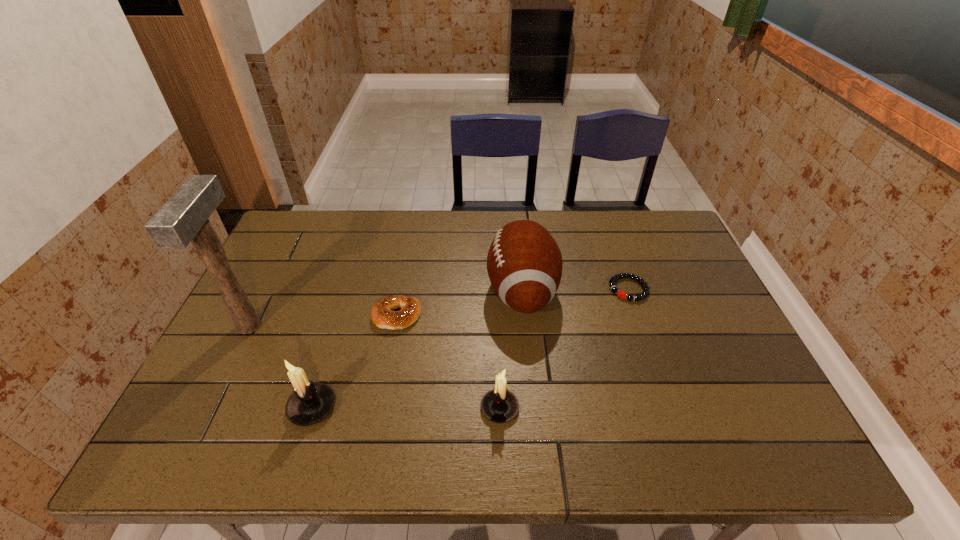
The height and width of the screenshot is (540, 960). What are the coordinates of `the third object from left to right` in the screenshot? It's located at [382, 314].

Identify the location of free space located 0.110m on the left of the left candle holder. The width and height of the screenshot is (960, 540). 240,407.

At what (x,y) coordinates should I click in order to perform the action: click on free space located 0.390m on the left of the right candle holder. Please return your answer as a coordinate pair (x, y). The width and height of the screenshot is (960, 540). Looking at the image, I should click on (310, 408).

Locate an element on the screen. Image resolution: width=960 pixels, height=540 pixels. free space located on the left of the shortest object is located at coordinates (588, 289).

Identify the location of vacant space situated 0.370m on the back of the mallet. (300, 224).

Where is `vacant area situated 0.270m on the laces of the second tallest object`? vacant area situated 0.270m on the laces of the second tallest object is located at coordinates (394, 291).

This screenshot has width=960, height=540. What are the coordinates of `blank space located 0.320m on the laces of the second tallest object` in the screenshot? It's located at (376, 291).

Where is `vacant region located 0.160m on the laces of the second tallest object`? This screenshot has height=540, width=960. vacant region located 0.160m on the laces of the second tallest object is located at coordinates (431, 291).

Where is `vacant space located 0.220m on the left of the bagel`? vacant space located 0.220m on the left of the bagel is located at coordinates (293, 316).

Where is `object present at the far edge`? The height and width of the screenshot is (540, 960). object present at the far edge is located at coordinates [x=524, y=263].